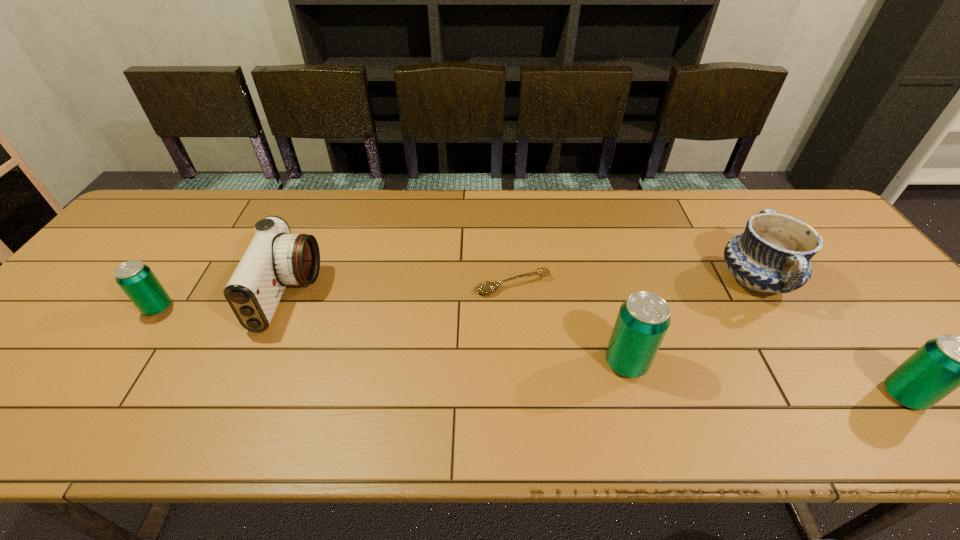
The width and height of the screenshot is (960, 540). What are the coordinates of `the leftmost object` in the screenshot? It's located at (137, 280).

I want to click on the farthest beer can, so click(137, 280).

I want to click on the second beer can from right to left, so point(643,319).

This screenshot has height=540, width=960. I want to click on the rightmost object, so click(941, 365).

The width and height of the screenshot is (960, 540). In order to click on the rightmost beer can in this screenshot , I will do `click(941, 365)`.

This screenshot has height=540, width=960. Identify the location of the third object from left to right. (488, 287).

Where is `the shortest object`? This screenshot has height=540, width=960. the shortest object is located at coordinates (488, 287).

Find the location of a particular element. camcorder is located at coordinates (275, 258).

Where is `pottery`? The image size is (960, 540). pottery is located at coordinates (772, 255).

Identify the location of vacant area located on the back of the leftmost beer can. (187, 266).